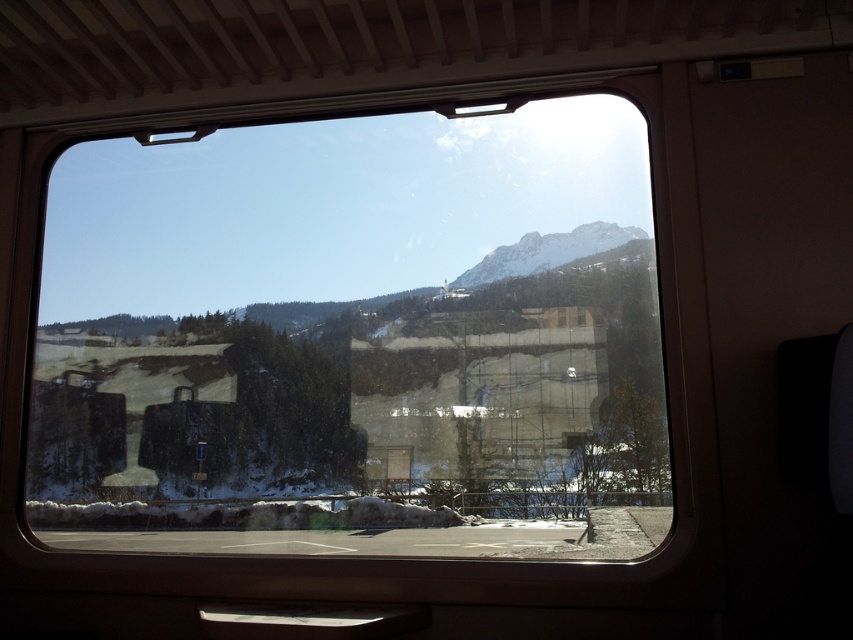
Is transparent glass train window at center positioned at the back of snowy rocky mountain at upper center?

No.

Between transparent glass train window at center and snowy rocky mountain at upper center, which one appears on the left side from the viewer's perspective?

transparent glass train window at center is more to the left.

This screenshot has height=640, width=853. In order to click on transparent glass train window at center in this screenshot , I will do `click(355, 339)`.

Locate an element on the screen. transparent glass train window at center is located at coordinates tap(355, 339).